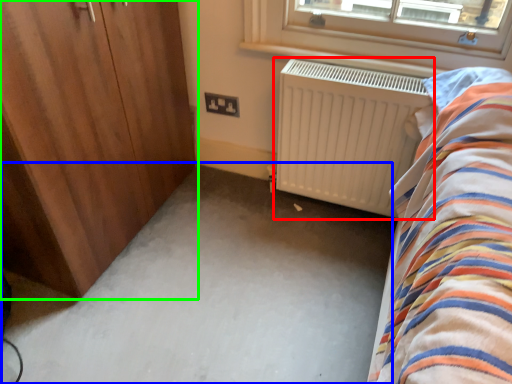
Question: Estimate the real-world distances between objects in this image. Which object is closer to radiator (highlighted by a red box), plain (highlighted by a blue box) or door (highlighted by a green box)?

Choices:
 (A) plain
 (B) door

Answer: (A)